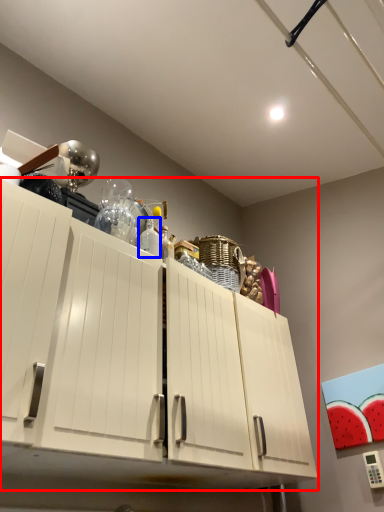
Question: Which of the following is the closest to the observer, cabinetry (highlighted by a red box) or bottle (highlighted by a blue box)?

Choices:
 (A) cabinetry
 (B) bottle

Answer: (A)